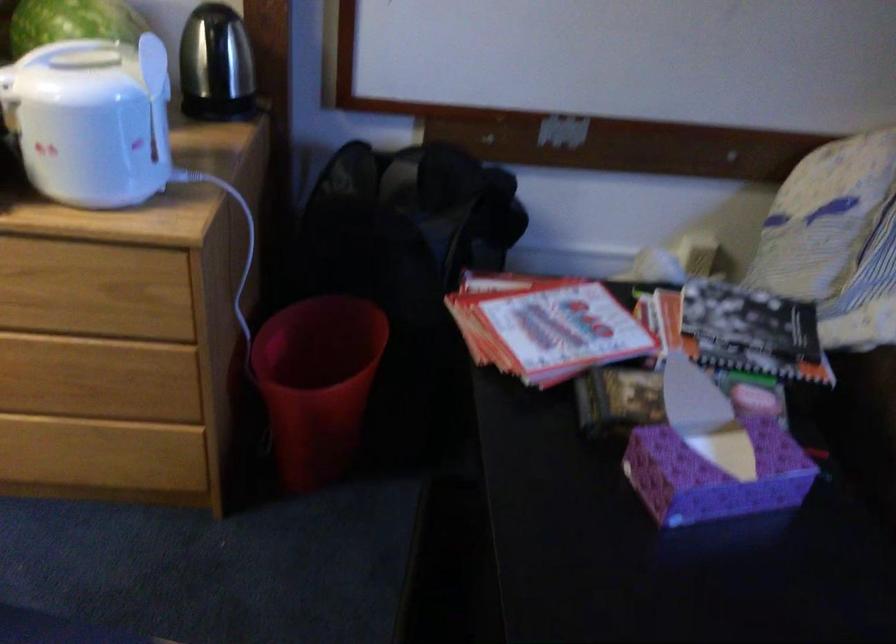
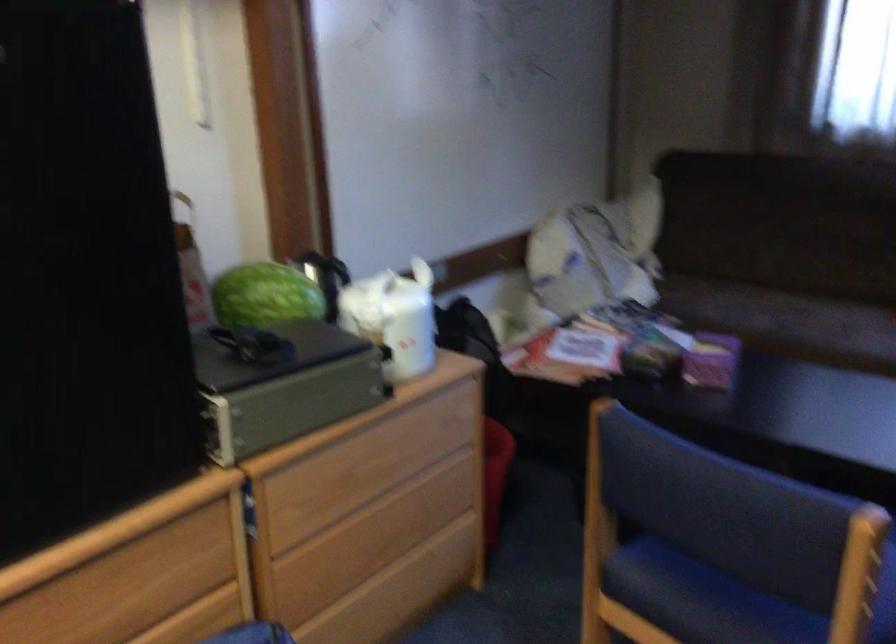
Find the pixel in the second image that matches [303,410] in the first image.

(495, 474)